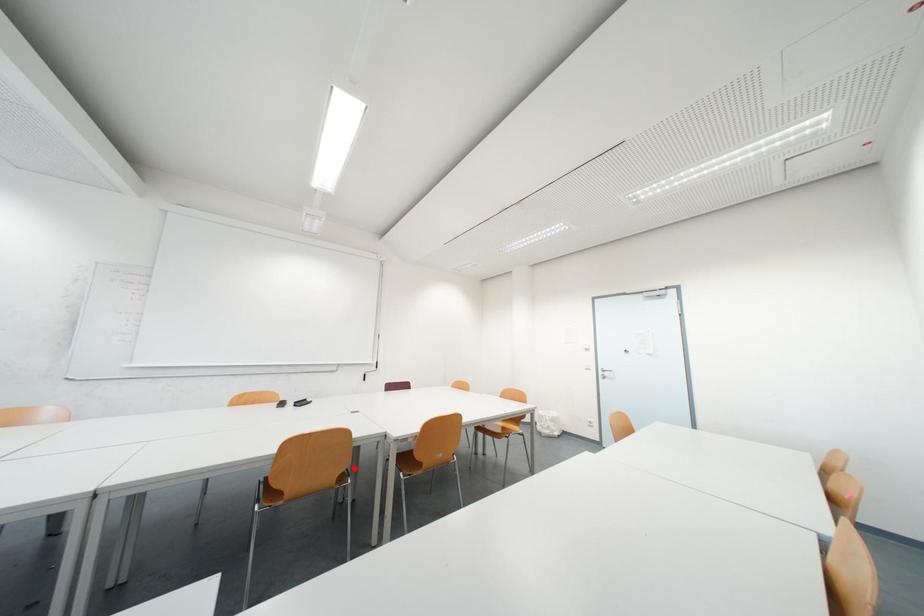
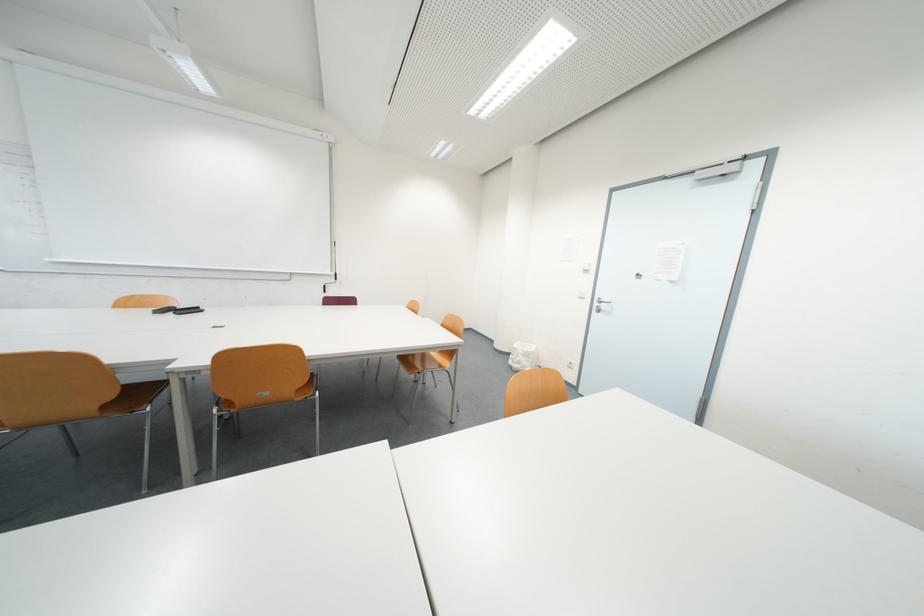
The point at the highlighted location is marked in the first image. Where is the corresponding point in the second image?

(120, 397)